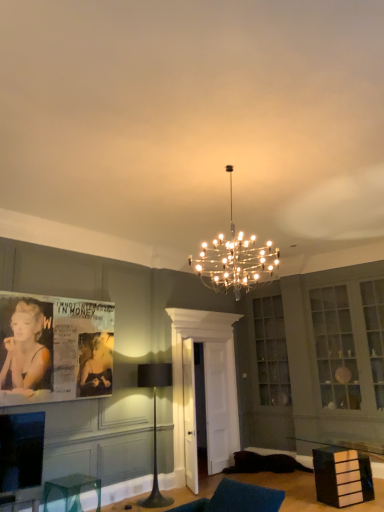
Question: Can you confirm if black matte floor lamp at center, which is the second lamp in right-to-left order, is positioned to the left of clear glass cube at lower left, which appears as the second furniture when viewed from the right?

Choices:
 (A) yes
 (B) no

Answer: (B)

Question: Is black matte floor lamp at center, arranged as the 2th lamp when viewed from the top, closer to camera compared to clear glass cube at lower left, which appears as the second furniture when viewed from the right?

Choices:
 (A) no
 (B) yes

Answer: (A)

Question: From a real-world perspective, is black matte floor lamp at center, placed as the first lamp when sorted from bottom to top, under clear glass cube at lower left, which appears as the second furniture when viewed from the right?

Choices:
 (A) yes
 (B) no

Answer: (B)

Question: From the image's perspective, does black matte floor lamp at center, the 1th lamp in the back-to-front sequence, appear higher than clear glass cube at lower left, the 1th furniture positioned from the left?

Choices:
 (A) no
 (B) yes

Answer: (B)

Question: Is black matte floor lamp at center, the 1th lamp in the back-to-front sequence, outside of clear glass cube at lower left, the 1th furniture positioned from the left?

Choices:
 (A) yes
 (B) no

Answer: (A)

Question: From the image's perspective, is black glossy drawer at lower right, acting as the 2th furniture starting from the left, located above or below clear glass door at center?

Choices:
 (A) below
 (B) above

Answer: (A)

Question: Is black glossy drawer at lower right, acting as the 2th furniture starting from the left, inside or outside of clear glass door at center?

Choices:
 (A) inside
 (B) outside

Answer: (B)

Question: Is black glossy drawer at lower right, acting as the 2th furniture starting from the left, in front of or behind clear glass door at center in the image?

Choices:
 (A) front
 (B) behind

Answer: (A)

Question: Is black glossy drawer at lower right, acting as the 2th furniture starting from the left, to the left or to the right of clear glass door at center in the image?

Choices:
 (A) left
 (B) right

Answer: (B)

Question: In terms of height, does clear glass cube at lower left, which appears as the second furniture when viewed from the right, look taller or shorter compared to clear glass door at center?

Choices:
 (A) tall
 (B) short

Answer: (B)

Question: Is clear glass cube at lower left, which appears as the second furniture when viewed from the right, bigger or smaller than clear glass door at center?

Choices:
 (A) small
 (B) big

Answer: (A)

Question: In terms of width, does clear glass cube at lower left, which appears as the second furniture when viewed from the right, look wider or thinner when compared to clear glass door at center?

Choices:
 (A) wide
 (B) thin

Answer: (A)

Question: From a real-world perspective, relative to clear glass door at center, is clear glass cube at lower left, the 1th furniture positioned from the left, vertically above or below?

Choices:
 (A) below
 (B) above

Answer: (A)

Question: Do you think clear glass cube at lower left, which appears as the second furniture when viewed from the right, is within clear glass chandelier at center, the first lamp when ordered from right to left, or outside of it?

Choices:
 (A) inside
 (B) outside

Answer: (B)

Question: From the image's perspective, is clear glass cube at lower left, the 1th furniture positioned from the left, located above or below clear glass chandelier at center, the second lamp viewed from the left?

Choices:
 (A) below
 (B) above

Answer: (A)